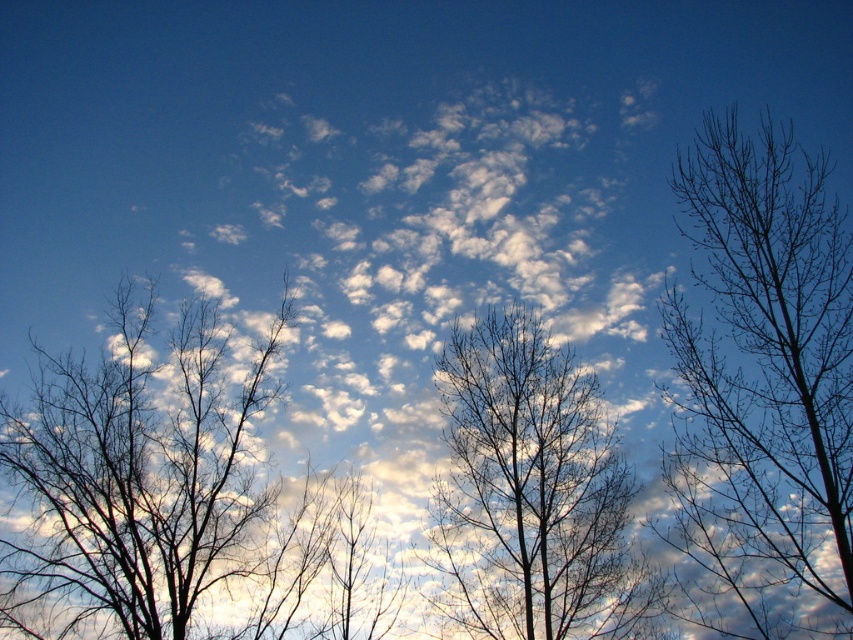
Question: Estimate the real-world distances between objects in this image. Which object is farther from the silhouette bare tree at left?

Choices:
 (A) bare branches at right
 (B) brown/dry wood tree at center

Answer: (A)

Question: Which is farther from the bare branches at right?

Choices:
 (A) brown/dry wood tree at center
 (B) silhouette bare tree at left

Answer: (B)

Question: Can you confirm if silhouette bare tree at left is positioned below brown/dry wood tree at center?

Choices:
 (A) no
 (B) yes

Answer: (B)

Question: Can you confirm if bare branches at right is positioned below brown/dry wood tree at center?

Choices:
 (A) yes
 (B) no

Answer: (A)

Question: Does bare branches at right lie in front of silhouette bare tree at left?

Choices:
 (A) no
 (B) yes

Answer: (B)

Question: Which is farther from the silhouette bare tree at left?

Choices:
 (A) bare branches at right
 (B) brown/dry wood tree at center

Answer: (A)